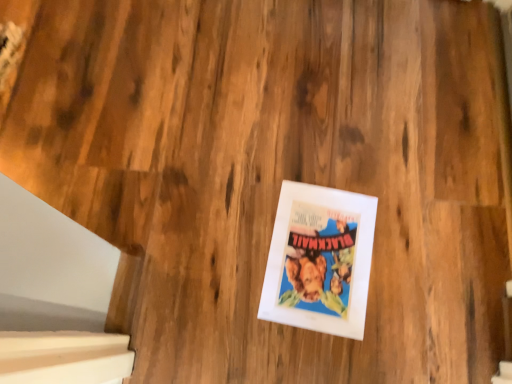
Where is `free space to the back side of white matte picture frame at center`? free space to the back side of white matte picture frame at center is located at coordinates (314, 141).